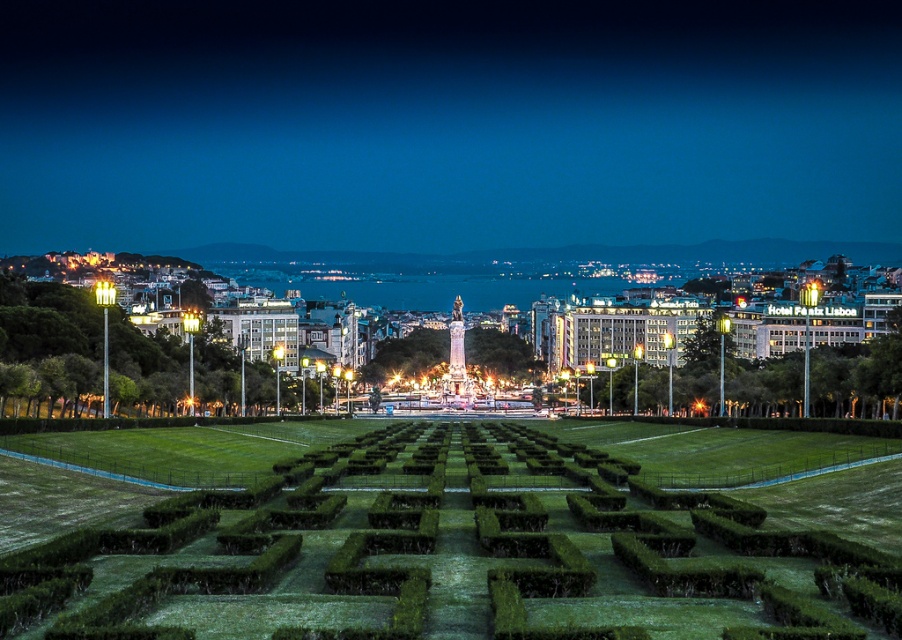
Question: Which object is farther from the camera taking this photo?

Choices:
 (A) green textured hedge at center
 (B) green grass hedge at left

Answer: (B)

Question: Does dark blue sky at upper center have a lesser width compared to green grass hedge at left?

Choices:
 (A) no
 (B) yes

Answer: (A)

Question: Among these objects, which one is farthest from the camera?

Choices:
 (A) green grass hedge at center
 (B) dark blue sky at upper center

Answer: (B)

Question: Which object appears closest to the camera in this image?

Choices:
 (A) green grass hedge at center
 (B) green grass hedge at left
 (C) dark blue sky at upper center
 (D) green textured hedge at center

Answer: (D)

Question: Is green textured hedge at center behind green grass hedge at center?

Choices:
 (A) yes
 (B) no

Answer: (B)

Question: Does green grass hedge at left have a smaller size compared to green grass hedge at center?

Choices:
 (A) yes
 (B) no

Answer: (B)